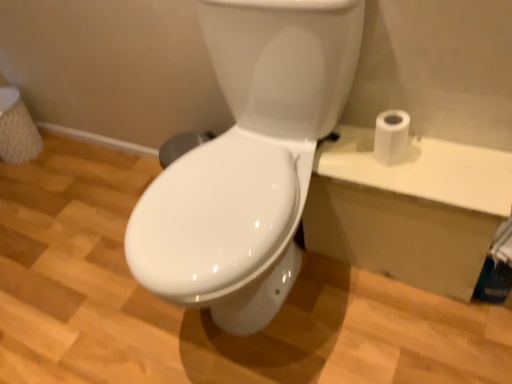
Question: Is white glossy toilet at center inside or outside of white matte toilet paper at right?

Choices:
 (A) outside
 (B) inside

Answer: (A)

Question: Visually, is white glossy toilet at center positioned to the left or to the right of white matte toilet paper at right?

Choices:
 (A) left
 (B) right

Answer: (A)

Question: From the image's perspective, is white glossy toilet at center above or below white matte toilet paper at right?

Choices:
 (A) below
 (B) above

Answer: (A)

Question: Is white matte toilet paper at right taller or shorter than white glossy toilet at center?

Choices:
 (A) tall
 (B) short

Answer: (B)

Question: From the image's perspective, relative to white glossy toilet at center, is white matte toilet paper at right above or below?

Choices:
 (A) below
 (B) above

Answer: (B)

Question: Which is correct: white matte toilet paper at right is inside white glossy toilet at center, or outside of it?

Choices:
 (A) outside
 (B) inside

Answer: (A)

Question: Considering their positions, is white matte toilet paper at right located in front of or behind white glossy toilet at center?

Choices:
 (A) behind
 (B) front

Answer: (A)